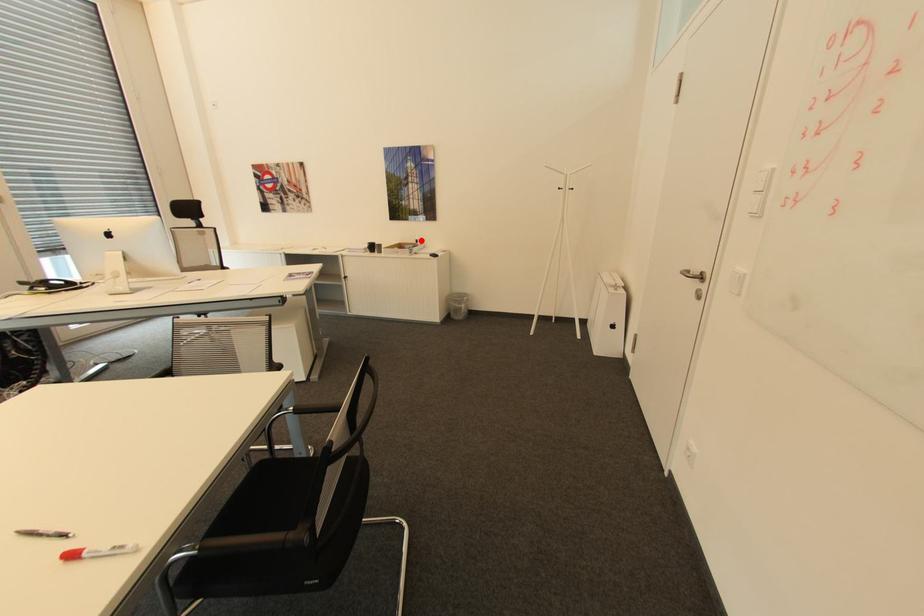
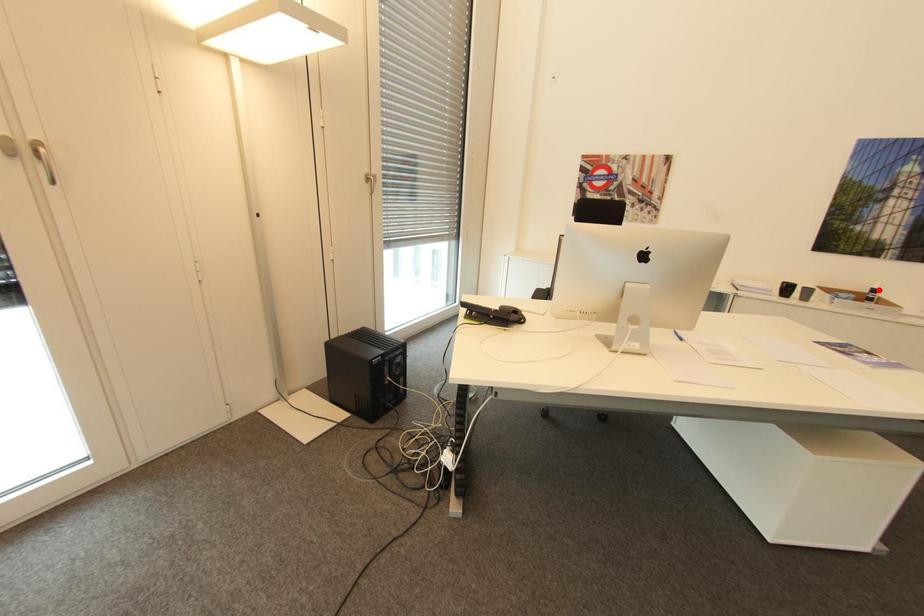
I am providing you with two images of the same scene from different viewpoints. A red point is marked on the first image and another point is marked on the second image. Does the point marked in image1 correspond to the same location as the one in image2?

Yes